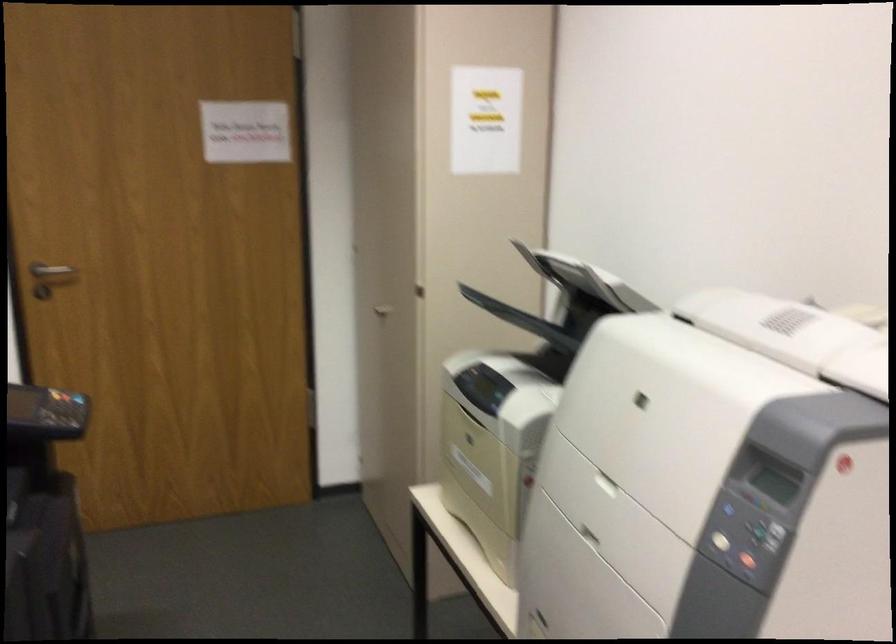
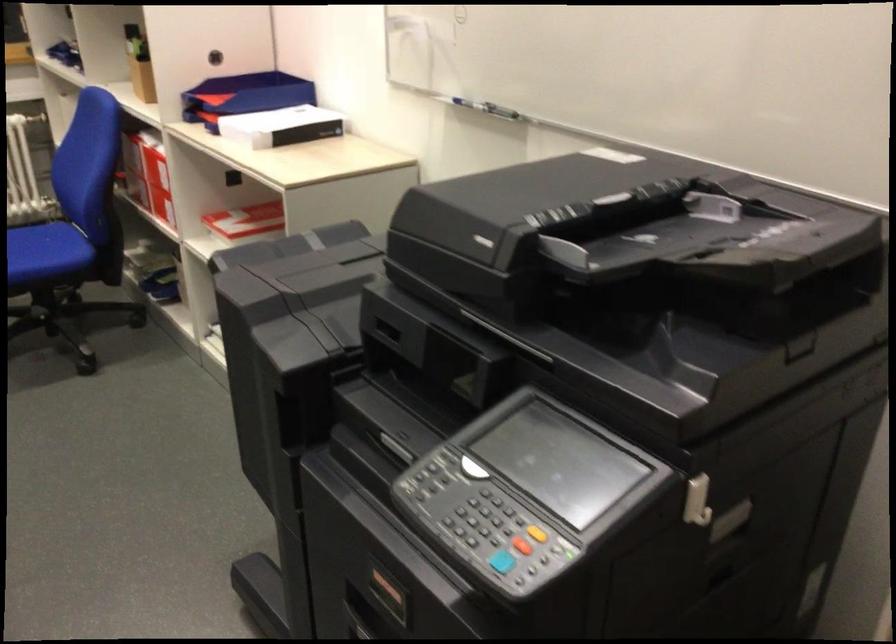
Where in the second image is the point corresponding to (75,408) from the first image?

(502, 562)